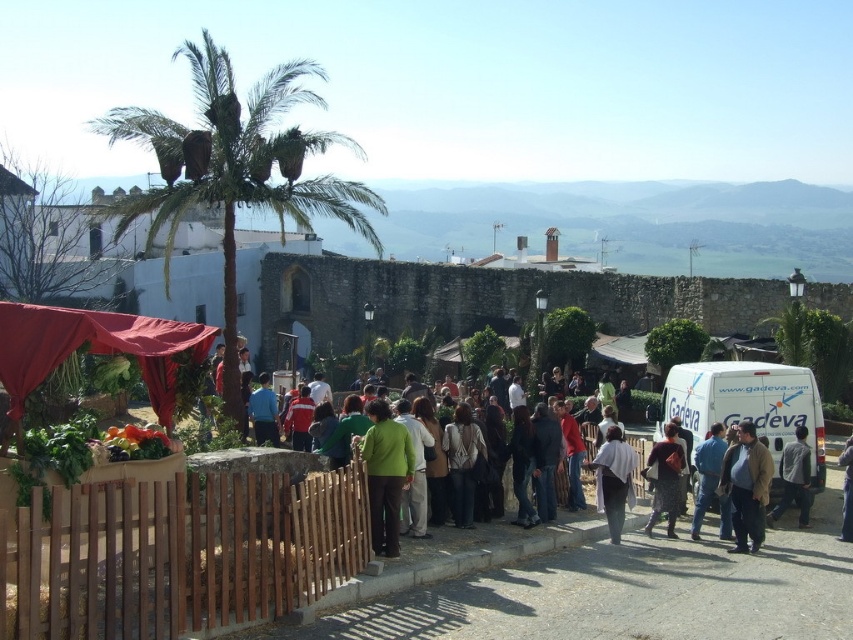
You are standing at the entrance of the market and want to take a photo of the brown wooden fence at lower left. Where should you position yourself to capture it in the frame?

The brown wooden fence at lower left is located at point 0.864 on the x axis and 0.209 on the y axis, so you should position yourself to the right and above that coordinate to capture it in the frame.